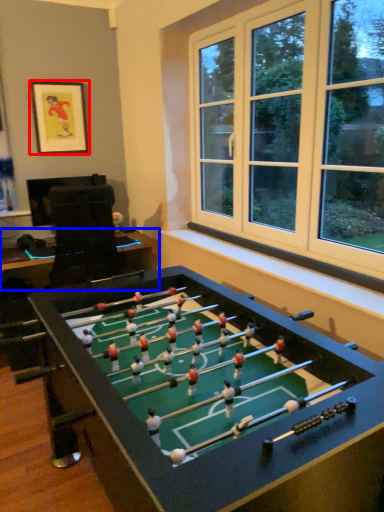
Question: Among these objects, which one is nearest to the camera, picture frame (highlighted by a red box) or table (highlighted by a blue box)?

Choices:
 (A) picture frame
 (B) table

Answer: (B)